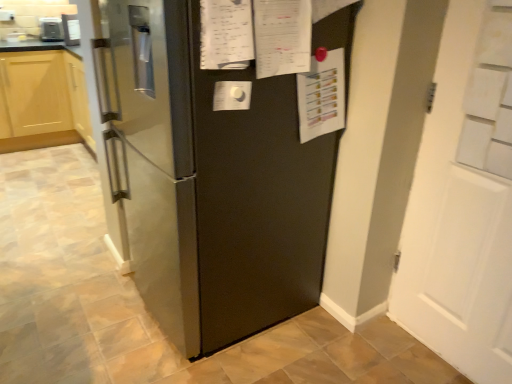
Question: Would you say white matte door at right contains satin silver toaster at upper left, placed as the 1th appliance when sorted from left to right?

Choices:
 (A) yes
 (B) no

Answer: (B)

Question: Is white matte door at right further to the viewer compared to satin silver toaster at upper left, which is the second appliance from front to back?

Choices:
 (A) yes
 (B) no

Answer: (B)

Question: Is white matte door at right completely or partially outside of satin silver toaster at upper left, acting as the 2th appliance starting from the right?

Choices:
 (A) no
 (B) yes

Answer: (B)

Question: From a real-world perspective, is white matte door at right positioned over satin silver toaster at upper left, which appears as the 1th appliance when viewed from the back, based on gravity?

Choices:
 (A) no
 (B) yes

Answer: (A)

Question: Can you confirm if white matte door at right is thinner than satin silver toaster at upper left, acting as the 2th appliance starting from the right?

Choices:
 (A) yes
 (B) no

Answer: (A)

Question: Considering the relative positions of satin silver toaster at upper left, placed as the 1th appliance when sorted from left to right, and satin black refrigerator at center in the image provided, is satin silver toaster at upper left, placed as the 1th appliance when sorted from left to right, to the left or to the right of satin black refrigerator at center?

Choices:
 (A) right
 (B) left

Answer: (B)

Question: From a real-world perspective, is satin silver toaster at upper left, acting as the 2th appliance starting from the right, above or below satin black refrigerator at center?

Choices:
 (A) above
 (B) below

Answer: (A)

Question: Relative to satin black refrigerator at center, is satin silver toaster at upper left, which is the second appliance from front to back, in front or behind?

Choices:
 (A) behind
 (B) front

Answer: (A)

Question: In terms of height, does satin silver toaster at upper left, which appears as the 1th appliance when viewed from the back, look taller or shorter compared to satin black refrigerator at center?

Choices:
 (A) short
 (B) tall

Answer: (A)

Question: Choose the correct answer: Is satin silver refrigerator at upper left, which appears as the first appliance when viewed from the right, inside satin silver toaster at upper left, acting as the 2th appliance starting from the right, or outside it?

Choices:
 (A) outside
 (B) inside

Answer: (A)

Question: From a real-world perspective, is satin silver refrigerator at upper left, placed as the second appliance when sorted from back to front, positioned above or below satin silver toaster at upper left, placed as the 1th appliance when sorted from left to right?

Choices:
 (A) below
 (B) above

Answer: (B)

Question: In terms of width, does satin silver refrigerator at upper left, which appears as the first appliance when viewed from the right, look wider or thinner when compared to satin silver toaster at upper left, acting as the 2th appliance starting from the right?

Choices:
 (A) thin
 (B) wide

Answer: (A)

Question: From the image's perspective, is satin silver refrigerator at upper left, placed as the second appliance when sorted from back to front, above or below satin silver toaster at upper left, which is the second appliance from front to back?

Choices:
 (A) above
 (B) below

Answer: (B)

Question: Is satin silver refrigerator at upper left, which is the first appliance in front-to-back order, taller or shorter than white matte door at right?

Choices:
 (A) short
 (B) tall

Answer: (A)

Question: From a real-world perspective, is satin silver refrigerator at upper left, which is the first appliance in front-to-back order, physically located above or below white matte door at right?

Choices:
 (A) below
 (B) above

Answer: (B)